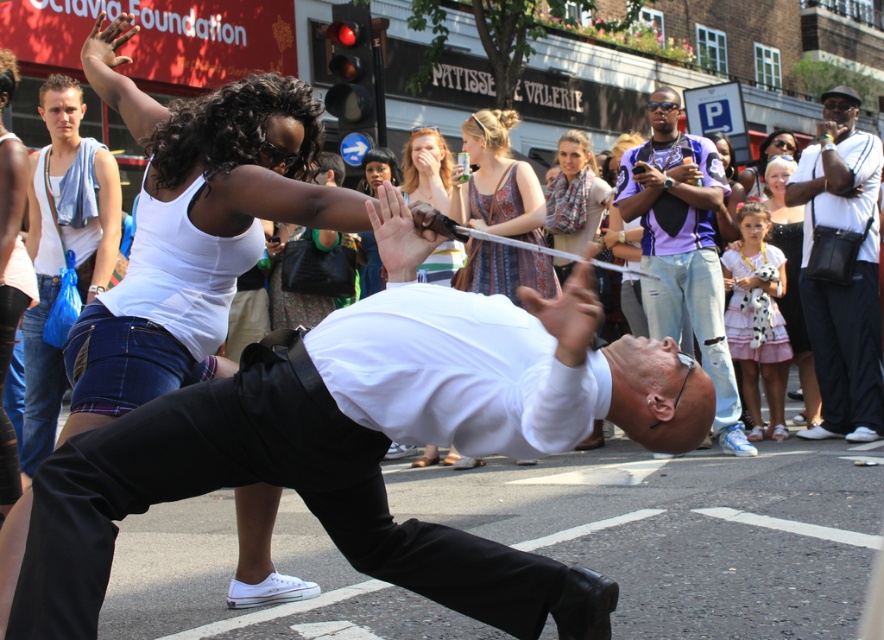
Question: Is the position of patterned scarf at upper center more distant than that of matte white blouse at upper center?

Choices:
 (A) yes
 (B) no

Answer: (B)

Question: In this image, where is white matte tank top at upper left located relative to matte white blouse at upper center?

Choices:
 (A) left
 (B) right

Answer: (A)

Question: Which object is closer to the camera taking this photo?

Choices:
 (A) white matte tank top at upper left
 (B) white cotton tank top at upper left
 (C) matte white shirt at center

Answer: (A)

Question: Is white matte tank top at upper left bigger than matte white blouse at upper center?

Choices:
 (A) no
 (B) yes

Answer: (B)

Question: Among these objects, which one is farthest from the camera?

Choices:
 (A) white cotton tank top at upper left
 (B) purple shirt at center
 (C) white matte tank top at upper left
 (D) white cotton shirt at upper right

Answer: (D)

Question: Estimate the real-world distances between objects in this image. Which object is closer to the matte white blouse at upper center?

Choices:
 (A) white matte tank top at upper left
 (B) matte white shirt at center

Answer: (B)